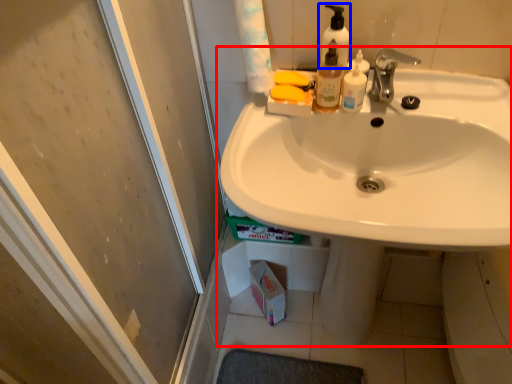
Question: Which of the following is the closest to the observer, sink (highlighted by a red box) or soap dispenser (highlighted by a blue box)?

Choices:
 (A) sink
 (B) soap dispenser

Answer: (A)